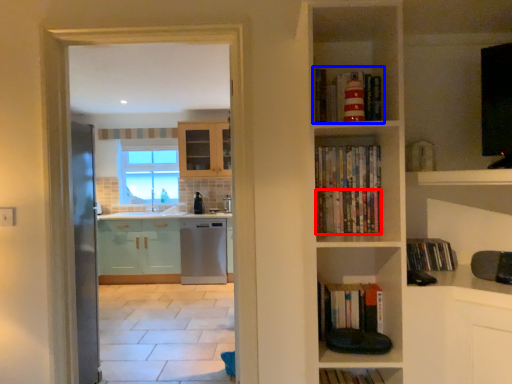
Question: Which object is further to the camera taking this photo, book (highlighted by a red box) or book (highlighted by a blue box)?

Choices:
 (A) book
 (B) book

Answer: (A)